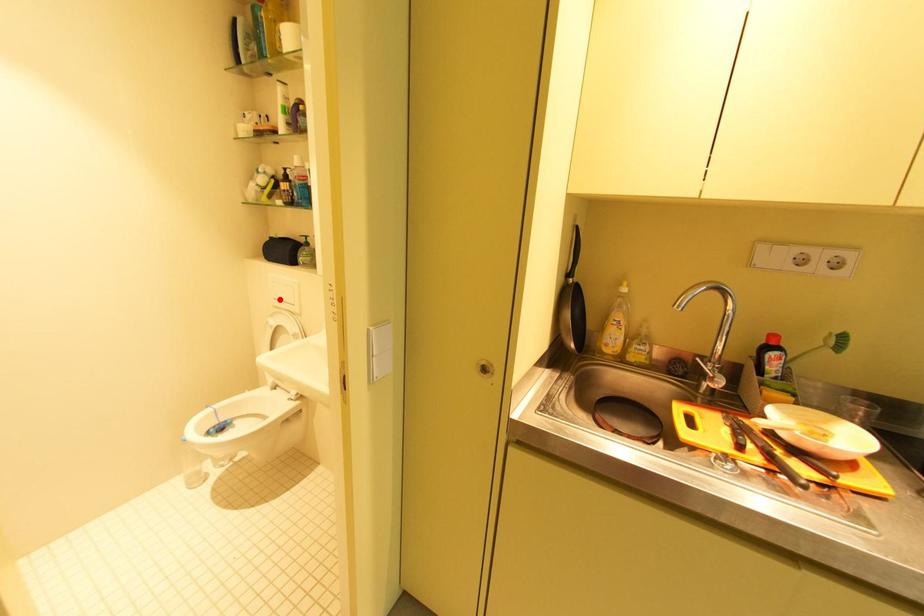
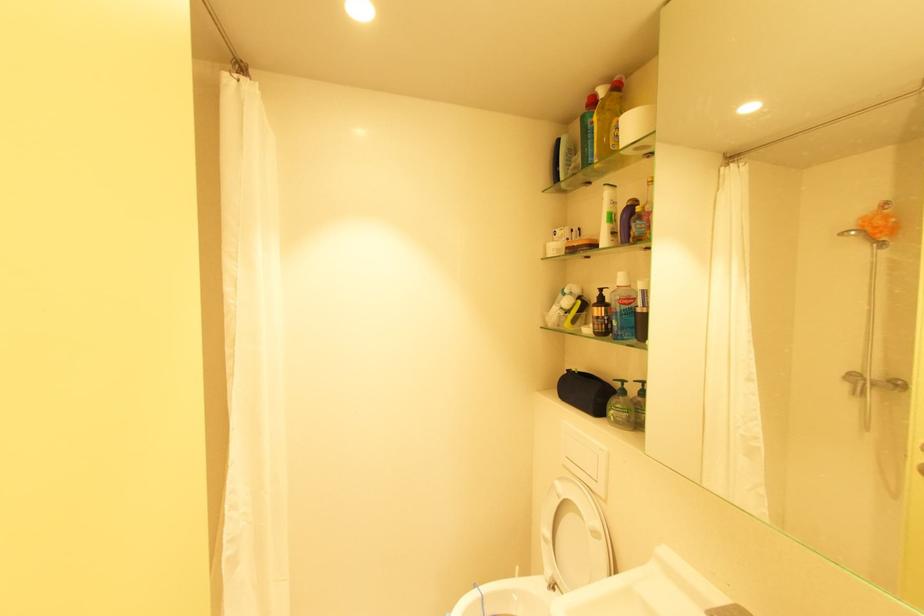
Where in the second image is the point corresponding to the highlighted location from the first image?

(572, 458)